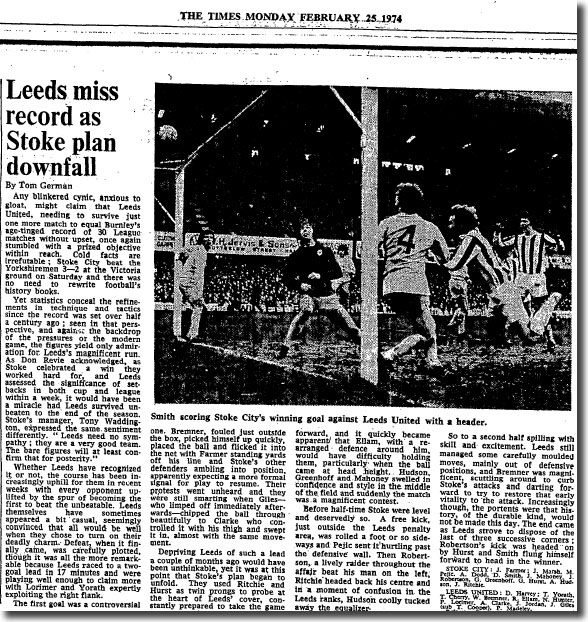
Where is `picture`? The height and width of the screenshot is (622, 588). picture is located at coordinates (303, 185).